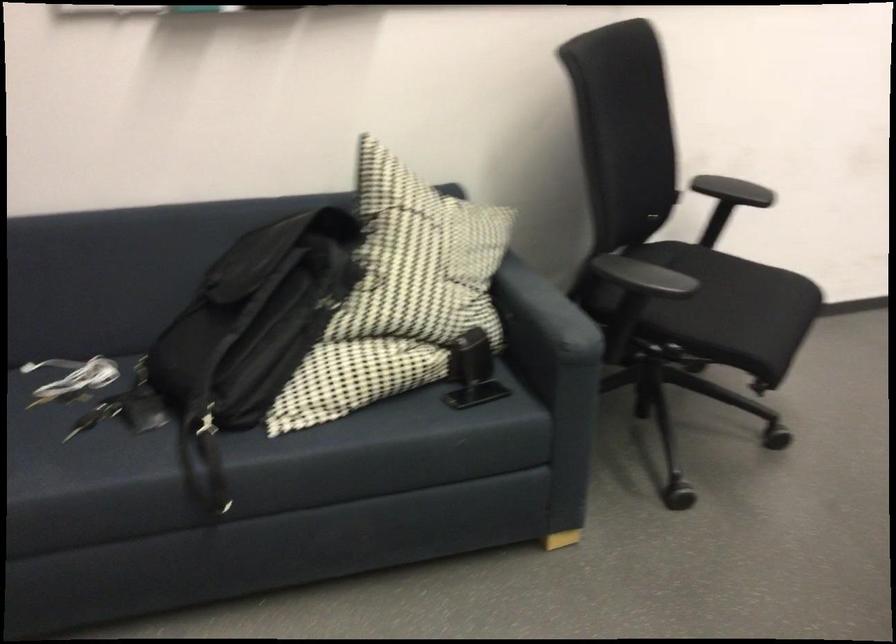
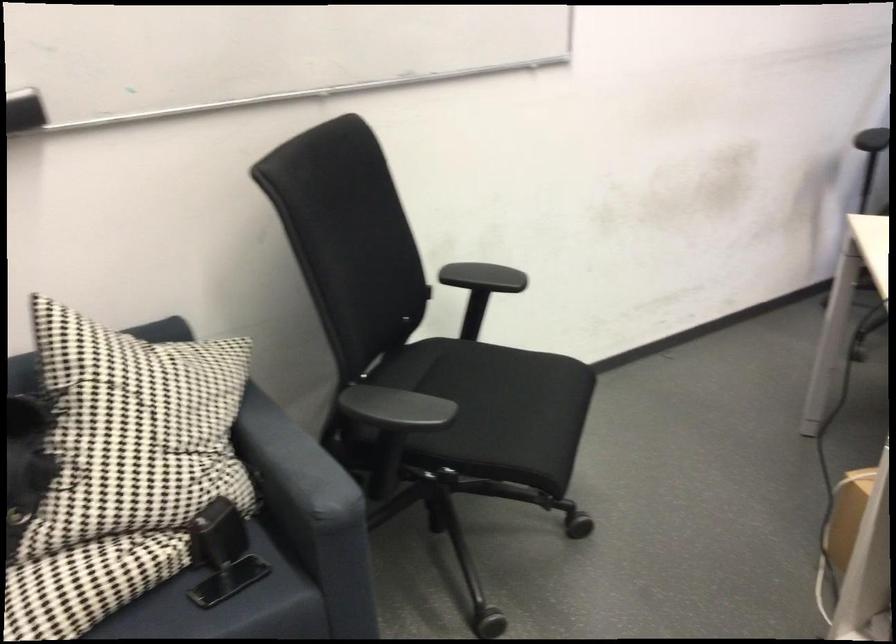
In the second image, find the point that corresponds to pixel 544 307 in the first image.

(293, 464)